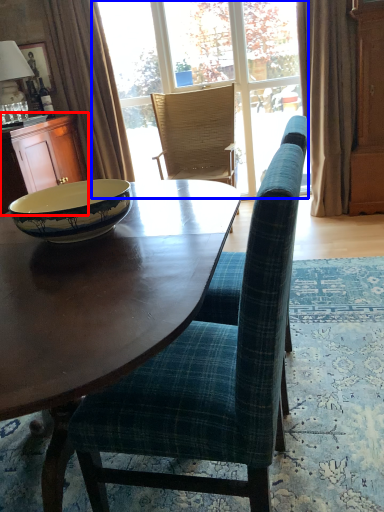
Question: Which object is further to the camera taking this photo, cabinetry (highlighted by a red box) or window (highlighted by a blue box)?

Choices:
 (A) cabinetry
 (B) window

Answer: (B)